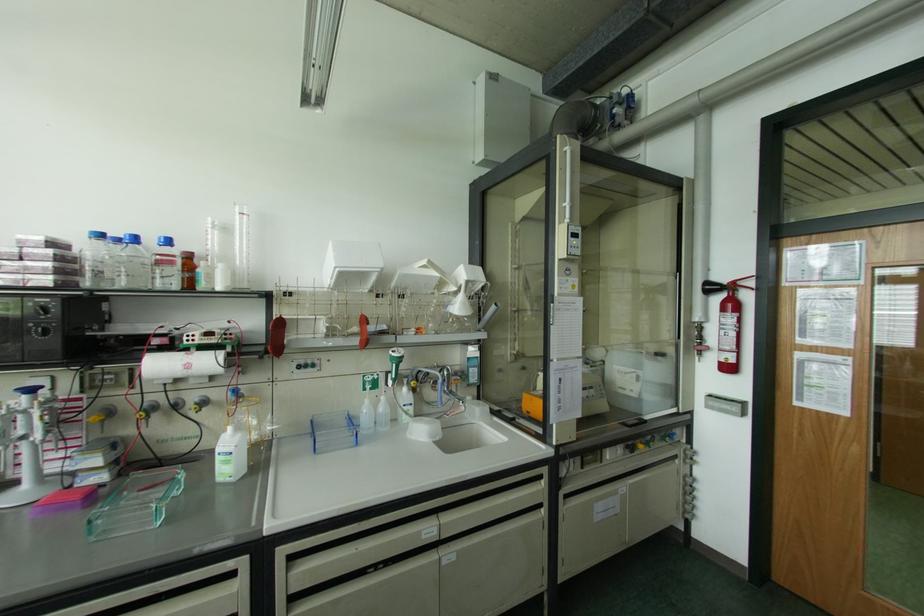
The width and height of the screenshot is (924, 616). In order to click on yellow control knob in this screenshot , I will do `click(140, 415)`.